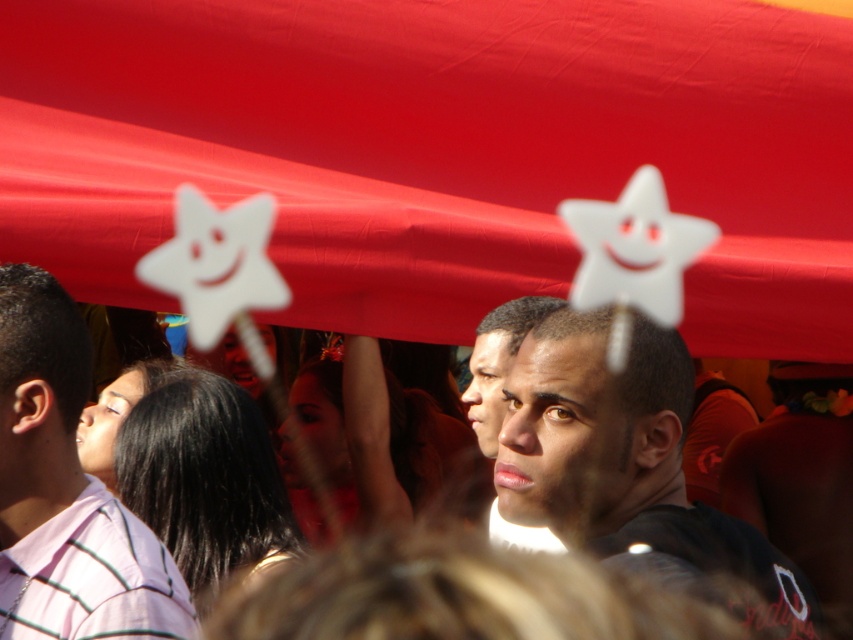
Question: Considering the real-world distances, which object is farthest from the pink striped shirt at left?

Choices:
 (A) matte black shirt at center
 (B) smooth skin face at center

Answer: (B)

Question: Which point is farther to the camera?

Choices:
 (A) (547, 310)
 (B) (555, 518)
 (C) (22, 525)

Answer: (A)

Question: Can you confirm if matte black shirt at center is wider than smooth skin face at center?

Choices:
 (A) no
 (B) yes

Answer: (B)

Question: Does matte black shirt at center have a smaller size compared to smooth skin face at center?

Choices:
 (A) no
 (B) yes

Answer: (A)

Question: Based on their relative distances, which object is farther from the smooth skin face at center?

Choices:
 (A) matte black shirt at center
 (B) pink striped shirt at left

Answer: (B)

Question: Does matte black shirt at center appear on the right side of pink striped shirt at left?

Choices:
 (A) no
 (B) yes

Answer: (B)